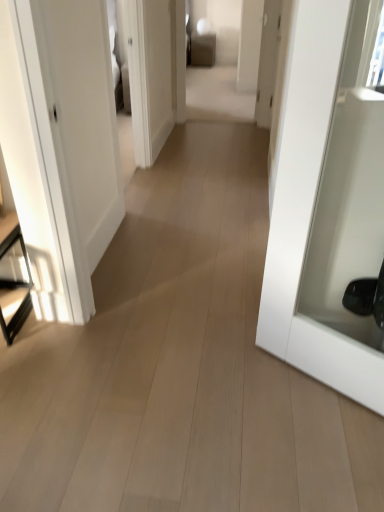
Measure the distance between point (357, 346) and camera.

Point (357, 346) and camera are 1.59 meters apart from each other.

Identify the location of white glossy door at right. The width and height of the screenshot is (384, 512). (328, 203).

What do you see at coordinates (328, 203) in the screenshot? I see `white glossy door at right` at bounding box center [328, 203].

Image resolution: width=384 pixels, height=512 pixels. In order to click on black glass table at left in this screenshot , I will do `click(11, 279)`.

Image resolution: width=384 pixels, height=512 pixels. What do you see at coordinates (11, 279) in the screenshot? I see `black glass table at left` at bounding box center [11, 279].

Where is `white glossy door at right`? The width and height of the screenshot is (384, 512). white glossy door at right is located at coordinates (328, 203).

Does black glass table at left appear on the right side of white glossy door at right?

Incorrect, black glass table at left is not on the right side of white glossy door at right.

Is the depth of black glass table at left greater than that of white glossy door at right?

Yes, it is.

Which is less distant, (24, 297) or (361, 264)?

Positioned in front is point (361, 264).

From the image's perspective, relative to white glossy door at right, is black glass table at left above or below?

From the image's perspective, black glass table at left appears below white glossy door at right.

From a real-world perspective, is black glass table at left below white glossy door at right?

Yes.

Based on the photo, does black glass table at left have a lesser width compared to white glossy door at right?

No, black glass table at left is not thinner than white glossy door at right.

In terms of height, does black glass table at left look taller or shorter compared to white glossy door at right?

Clearly, black glass table at left is shorter compared to white glossy door at right.

Does black glass table at left have a smaller size compared to white glossy door at right?

Indeed, black glass table at left has a smaller size compared to white glossy door at right.

Is black glass table at left not within white glossy door at right?

Indeed, black glass table at left is completely outside white glossy door at right.

Is black glass table at left not near white glossy door at right?

Yes, black glass table at left and white glossy door at right are quite far apart.

Is black glass table at left oriented away from white glossy door at right?

No, black glass table at left is not facing the opposite direction of white glossy door at right.

How many degrees apart are the facing directions of black glass table at left and white glossy door at right?

The angular difference between black glass table at left and white glossy door at right is 33.9 degrees.

At what (x,y) coordinates should I click in order to perform the action: click on furniture below the white glossy door at right (from the image's perspective). Please return your answer as a coordinate pair (x, y). This screenshot has height=512, width=384. Looking at the image, I should click on (11, 279).

From the picture: Between white glossy door at right and black glass table at left, which one appears on the right side from the viewer's perspective?

white glossy door at right is more to the right.

Is white glossy door at right positioned before black glass table at left?

Yes, it is.

Is point (299, 93) positioned before point (5, 249)?

Yes, it is.

From the image's perspective, which one is positioned lower, white glossy door at right or black glass table at left?

black glass table at left is shown below in the image.

From a real-world perspective, between white glossy door at right and black glass table at left, who is vertically higher?

In real-world perspective, white glossy door at right is above.

In terms of width, does white glossy door at right look wider or thinner when compared to black glass table at left?

Clearly, white glossy door at right has less width compared to black glass table at left.

From their relative heights in the image, would you say white glossy door at right is taller or shorter than black glass table at left?

Clearly, white glossy door at right is taller compared to black glass table at left.

Considering the relative sizes of white glossy door at right and black glass table at left in the image provided, is white glossy door at right bigger than black glass table at left?

Yes, white glossy door at right is bigger than black glass table at left.

Is white glossy door at right not within black glass table at left?

Yes.

Is white glossy door at right not close to black glass table at left?

white glossy door at right is far away from black glass table at left.

Is white glossy door at right oriented away from black glass table at left?

white glossy door at right does not have its back to black glass table at left.

What's the angular difference between white glossy door at right and black glass table at left's facing directions?

They differ by 33.9 degrees in their facing directions.

I want to click on furniture to the left of white glossy door at right, so click(x=11, y=279).

Where is `door lying on the right of black glass table at left`? This screenshot has height=512, width=384. door lying on the right of black glass table at left is located at coordinates (328, 203).

Identify the location of furniture that appears behind the white glossy door at right. point(11,279).